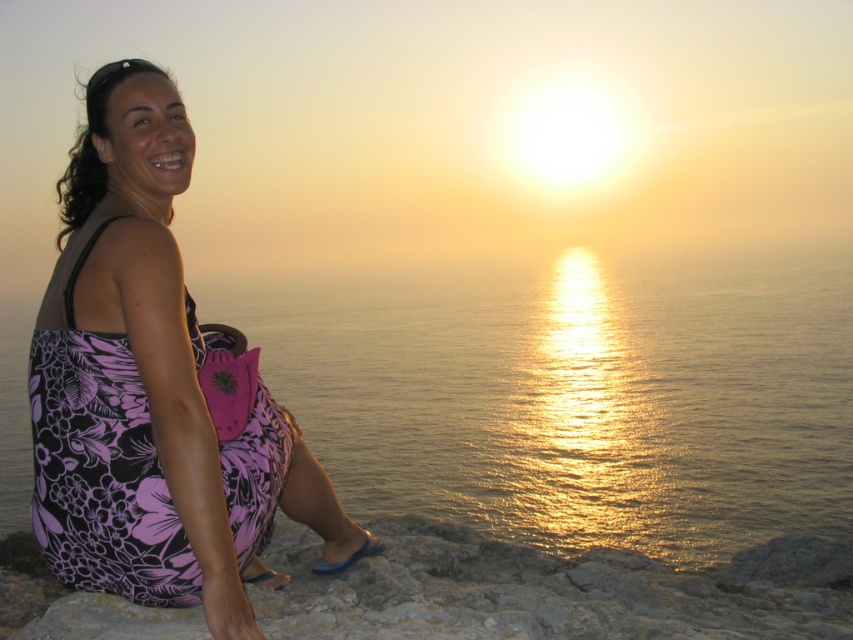
Question: Is golden reflective water at center smaller than floral dress at left?

Choices:
 (A) yes
 (B) no

Answer: (B)

Question: Is golden reflective water at center closer to camera compared to floral dress at left?

Choices:
 (A) yes
 (B) no

Answer: (B)

Question: Which object appears closest to the camera in this image?

Choices:
 (A) floral dress at left
 (B) golden reflective water at center

Answer: (A)

Question: Is golden reflective water at center further to the viewer compared to floral dress at left?

Choices:
 (A) yes
 (B) no

Answer: (A)

Question: Which point is farther from the camera taking this photo?

Choices:
 (A) (1, 346)
 (B) (270, 436)

Answer: (A)